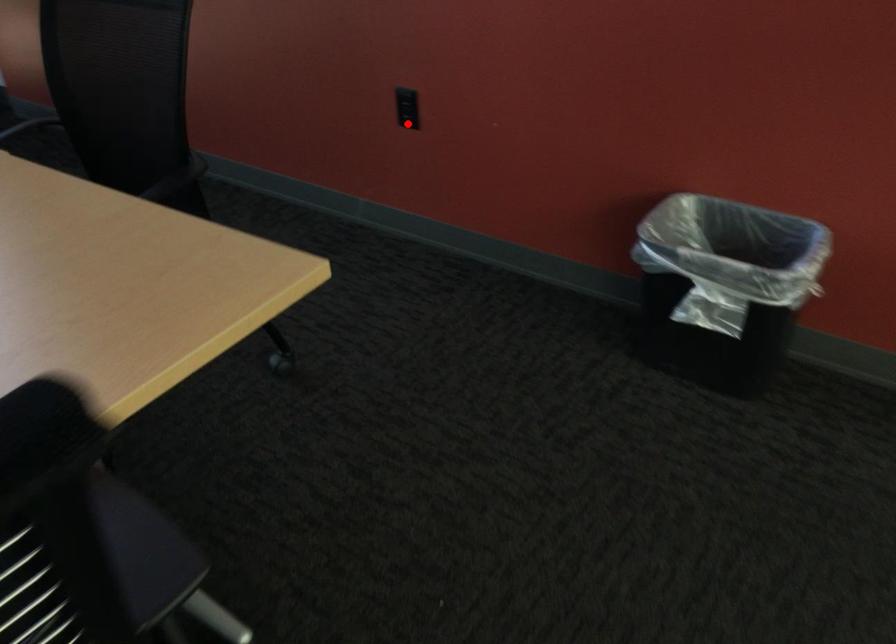
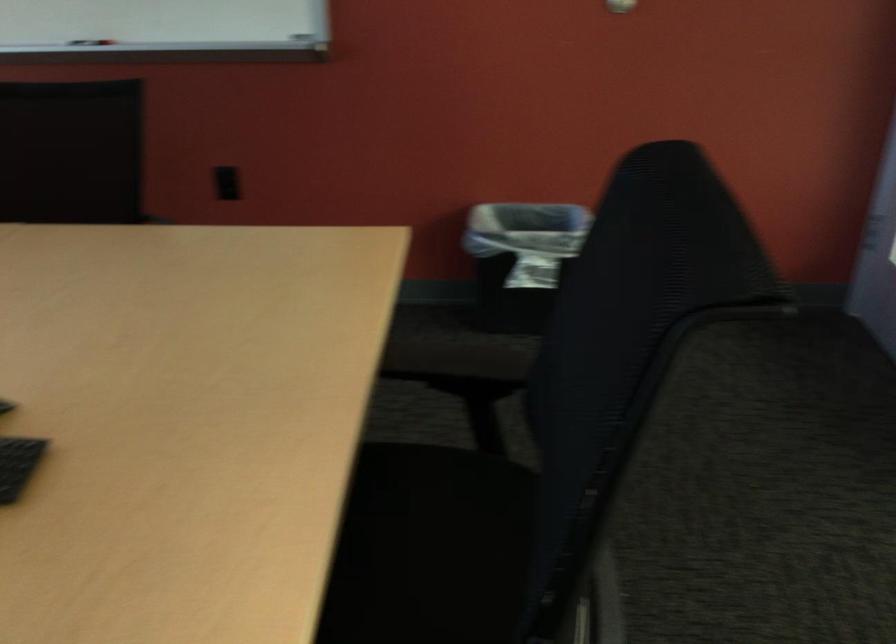
Question: I am providing you with two images of the same scene from different viewpoints. Given a red point in image1, look at the same physical point in image2. Is it:

Choices:
 (A) Closer to the viewpoint
 (B) Farther from the viewpoint

Answer: (B)